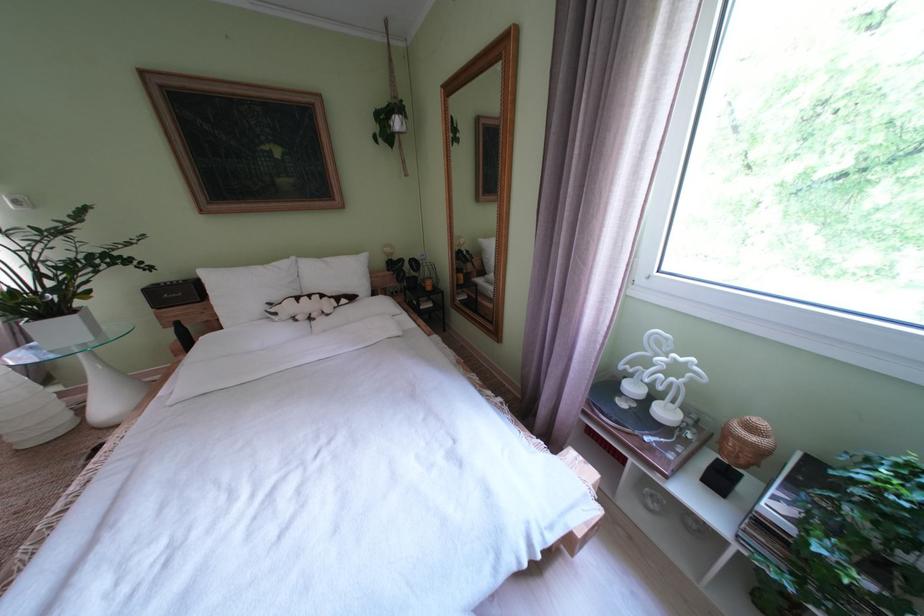
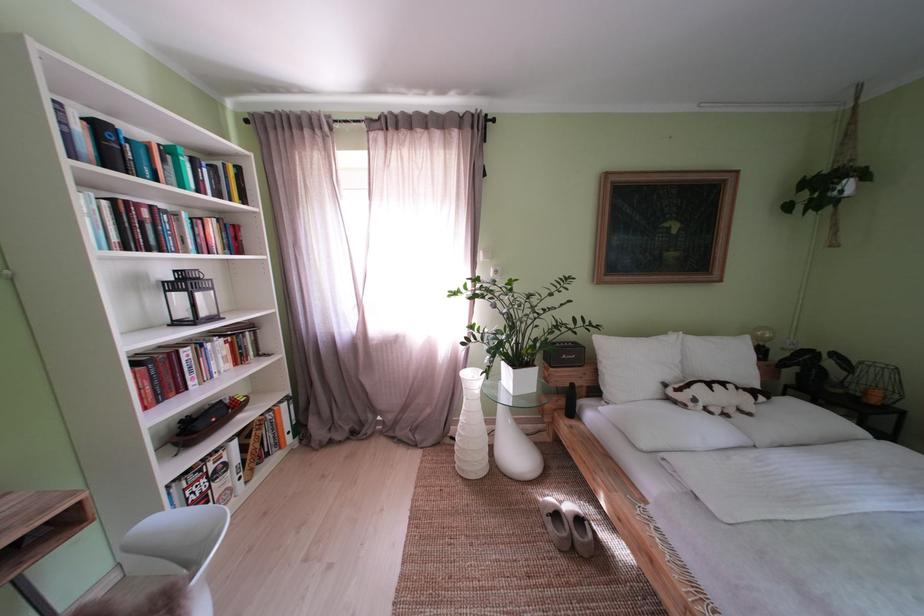
The point at (286,318) is marked in the first image. Where is the corresponding point in the second image?

(706, 406)